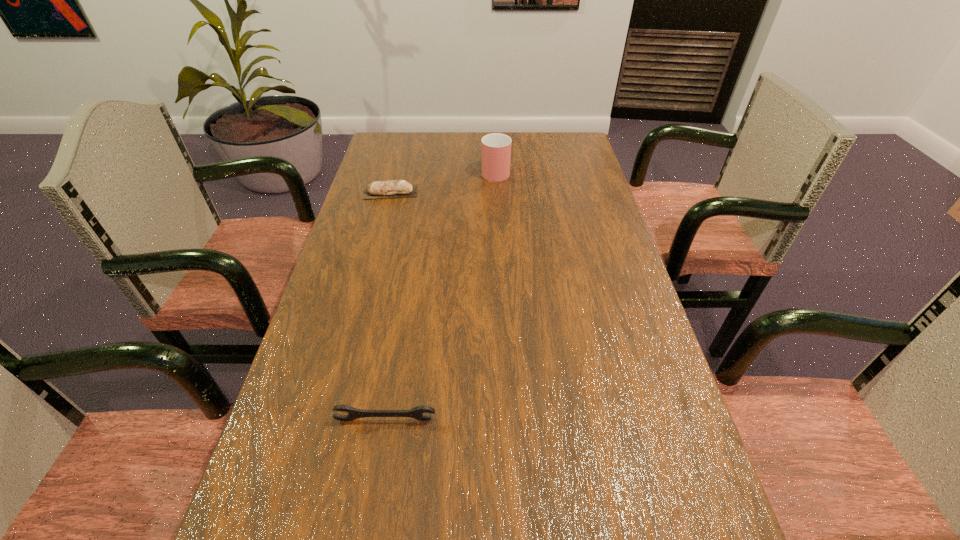
Identify the location of free space between the wrench and the rightmost object. (441, 295).

The width and height of the screenshot is (960, 540). I want to click on vacant point located between the tallest object and the wrench, so click(441, 295).

What are the coordinates of `empty space between the nearest object and the tallest object` in the screenshot? It's located at coord(441,295).

At what (x,y) coordinates should I click in order to perform the action: click on the closest object to the pita bread. Please return your answer as a coordinate pair (x, y). Looking at the image, I should click on (496, 148).

Identify which object is located as the second nearest to the wrench. Please provide its 2D coordinates. Your answer should be formatted as a tuple, i.e. [(x, y)], where the tuple contains the x and y coordinates of a point satisfying the conditions above.

[(496, 148)]